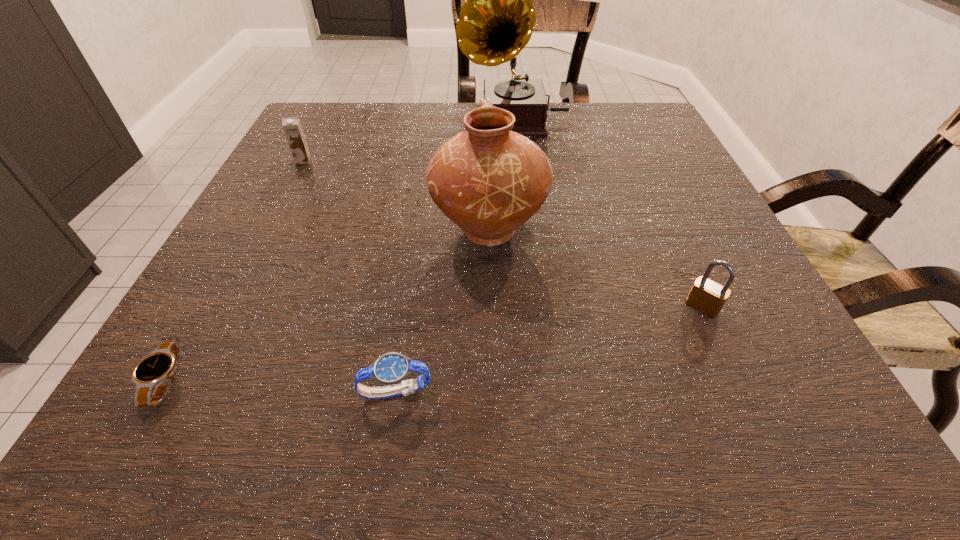
This screenshot has height=540, width=960. In the image, there is a desktop. What are the coordinates of `free space at the far left corner` in the screenshot? It's located at (315, 134).

Locate an element on the screen. vacant area at the near left corner of the desktop is located at coordinates [193, 412].

Locate an element on the screen. The height and width of the screenshot is (540, 960). vacant region at the far right corner of the desktop is located at coordinates (629, 142).

This screenshot has width=960, height=540. In the image, there is a desktop. In order to click on free space at the near right corner in this screenshot , I will do `click(740, 429)`.

Locate an element on the screen. free area in between the left watch and the rightmost object is located at coordinates (433, 344).

Image resolution: width=960 pixels, height=540 pixels. I want to click on vacant space that is in between the fifth shortest object and the left watch, so click(x=326, y=305).

The width and height of the screenshot is (960, 540). What are the coordinates of `vacant region between the left watch and the fifth shortest object` in the screenshot? It's located at (326, 305).

Identify the location of vacant region between the fifth shortest object and the rightmost object. This screenshot has width=960, height=540. (595, 268).

Where is `unoccupied area between the second tallest object and the taller watch`? unoccupied area between the second tallest object and the taller watch is located at coordinates (442, 311).

This screenshot has height=540, width=960. I want to click on unoccupied position between the fifth tallest object and the shorter watch, so (280, 387).